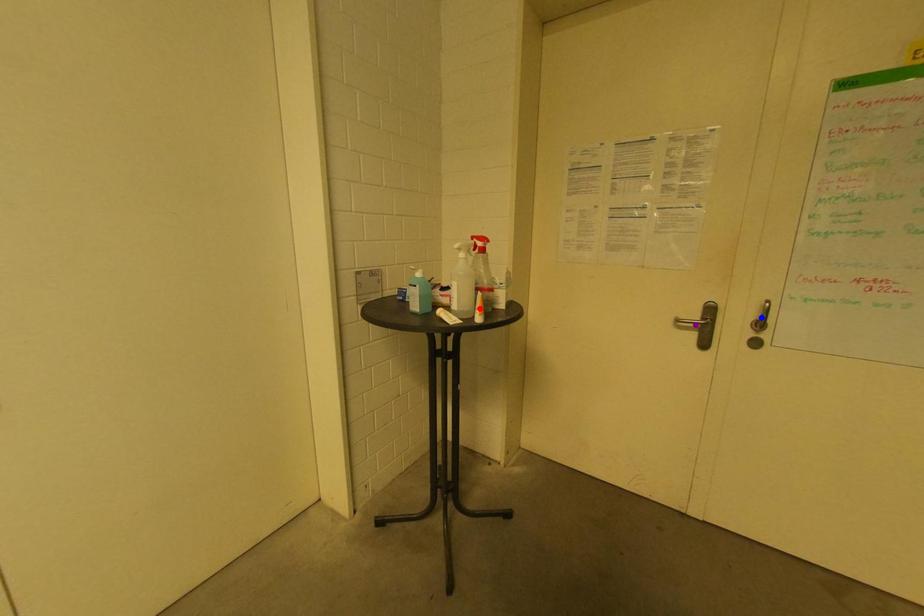
Order these from farthest to nearest:
1. red point
2. purple point
3. blue point

purple point, blue point, red point